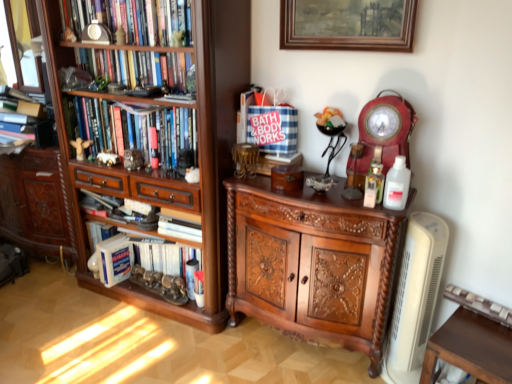
Question: From the image's perspective, is matte white clock at upper left, which is the 4th book in bottom-to-top order, beneath polished wood cabinet at center?

Choices:
 (A) no
 (B) yes

Answer: (A)

Question: From the image's perspective, is matte white clock at upper left, marked as the 1th book in a top-to-bottom arrangement, above polished wood cabinet at center?

Choices:
 (A) no
 (B) yes

Answer: (B)

Question: Is matte white clock at upper left, which is the 4th book in bottom-to-top order, positioned with its back to polished wood cabinet at center?

Choices:
 (A) no
 (B) yes

Answer: (A)

Question: Is matte white clock at upper left, which is the 4th book in bottom-to-top order, far from polished wood cabinet at center?

Choices:
 (A) no
 (B) yes

Answer: (B)

Question: Does matte white clock at upper left, marked as the 1th book in a top-to-bottom arrangement, have a greater width compared to polished wood cabinet at center?

Choices:
 (A) yes
 (B) no

Answer: (B)

Question: Would you say hardcover book at lower left is inside or outside matte gold angel at left, marked as the 2th toy in a right-to-left arrangement?

Choices:
 (A) outside
 (B) inside

Answer: (A)

Question: Based on their sizes in the image, would you say hardcover book at lower left is bigger or smaller than matte gold angel at left, the 1th toy viewed from the left?

Choices:
 (A) small
 (B) big

Answer: (B)

Question: From a real-world perspective, is hardcover book at lower left positioned above or below matte gold angel at left, the 1th toy viewed from the left?

Choices:
 (A) above
 (B) below

Answer: (B)

Question: Considering the relative positions of hardcover book at lower left and matte gold angel at left, marked as the 2th toy in a right-to-left arrangement, in the image provided, is hardcover book at lower left to the left or to the right of matte gold angel at left, marked as the 2th toy in a right-to-left arrangement,?

Choices:
 (A) right
 (B) left

Answer: (A)

Question: From the image's perspective, is hardcover book at lower left located above or below polished wood cabinet at center?

Choices:
 (A) above
 (B) below

Answer: (B)

Question: Does point (111, 258) appear closer or farther from the camera than point (358, 284)?

Choices:
 (A) closer
 (B) farther

Answer: (B)

Question: Which is correct: hardcover book at lower left is inside polished wood cabinet at center, or outside of it?

Choices:
 (A) outside
 (B) inside

Answer: (A)

Question: From a real-world perspective, is hardcover book at lower left positioned above or below polished wood cabinet at center?

Choices:
 (A) above
 (B) below

Answer: (B)

Question: In the image, is white plastic bottle at right positioned in front of or behind matte gold angel at left, the 1th toy viewed from the left?

Choices:
 (A) behind
 (B) front

Answer: (B)

Question: In the image, is white plastic bottle at right on the left side or the right side of matte gold angel at left, marked as the 2th toy in a right-to-left arrangement?

Choices:
 (A) left
 (B) right

Answer: (B)